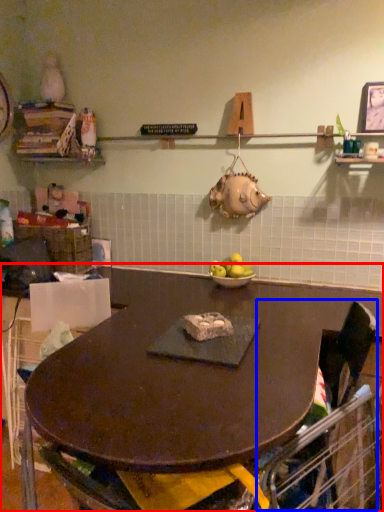
Question: Among these objects, which one is farthest to the camera, table (highlighted by a red box) or swivel chair (highlighted by a blue box)?

Choices:
 (A) table
 (B) swivel chair

Answer: (B)